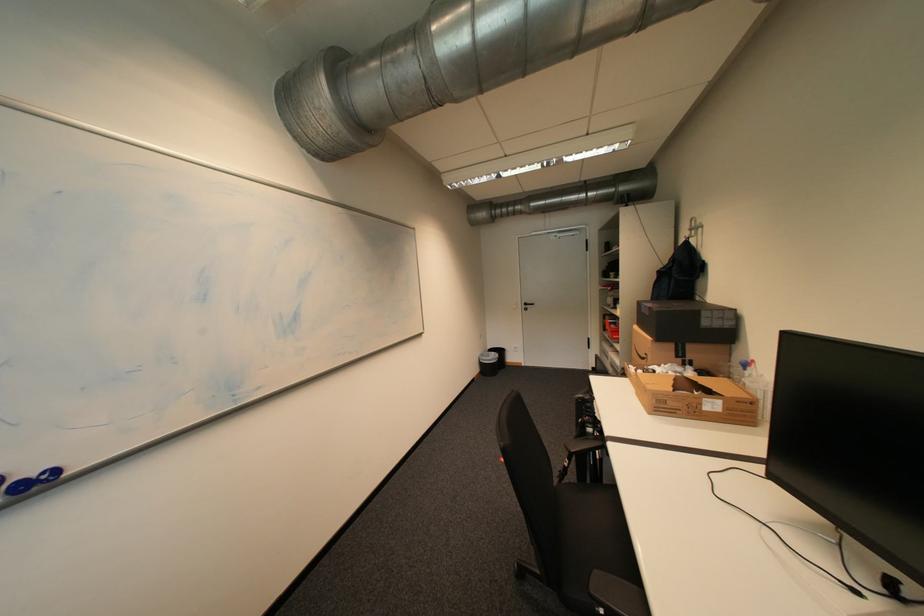
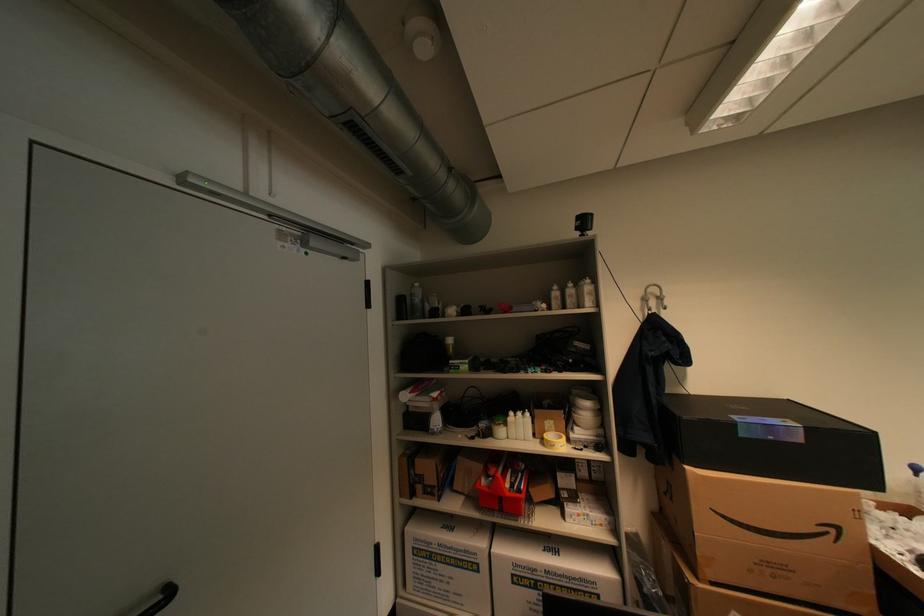
Where in the second image is the point corresponding to [612,353] from the first image?

(439, 556)